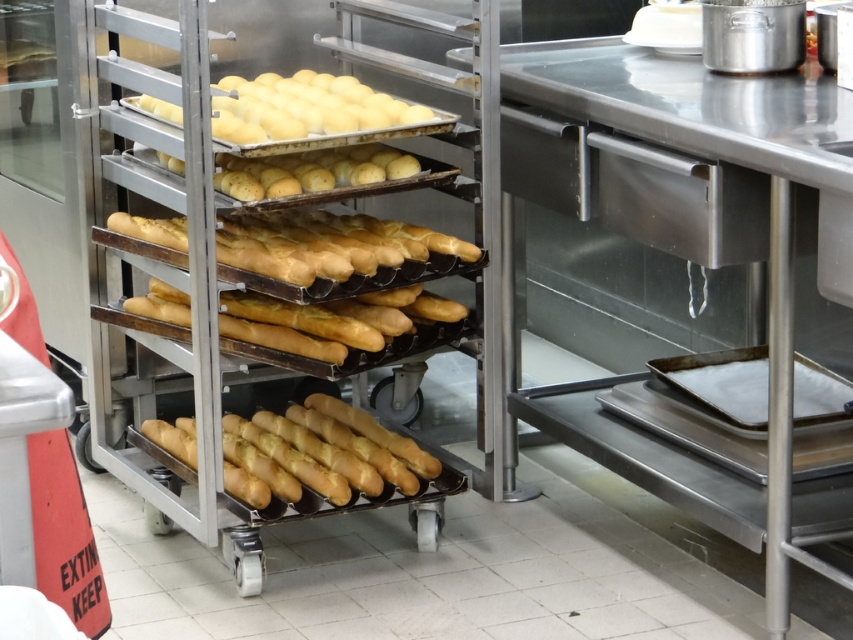
Can you confirm if golden matte baguettes at center is positioned to the left of smooth golden bread at center?

Yes, golden matte baguettes at center is to the left of smooth golden bread at center.

This screenshot has width=853, height=640. Identify the location of golden matte baguettes at center. (334, 248).

Between golden matte baguette at center and yellow matte doughnuts at center, which one is positioned lower?

golden matte baguette at center is below.

Describe the element at coordinates (325, 451) in the screenshot. I see `golden matte baguette at center` at that location.

Where is `golden matte baguette at center`? The width and height of the screenshot is (853, 640). golden matte baguette at center is located at coordinates (325, 451).

Between golden matte baguettes at center and yellow matte doughnuts at center, which one is positioned lower?

Result: golden matte baguettes at center is lower down.

Can you confirm if golden matte baguettes at center is shorter than yellow matte doughnuts at center?

Yes, golden matte baguettes at center is shorter than yellow matte doughnuts at center.

Does point (300, 256) come closer to viewer compared to point (375, 99)?

Yes, it is in front of point (375, 99).

This screenshot has width=853, height=640. Identify the location of golden matte baguettes at center. (334, 248).